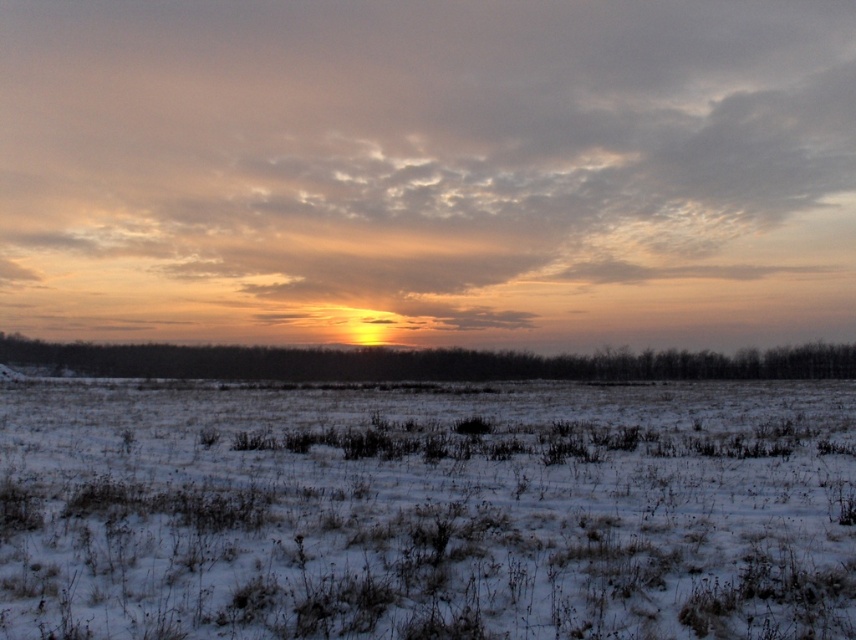
Question: Can you confirm if cloudy sky at center is smaller than white snow-covered grassland at center?

Choices:
 (A) yes
 (B) no

Answer: (B)

Question: Which point is farther from the camera taking this photo?

Choices:
 (A) (432, 120)
 (B) (605, 500)

Answer: (A)

Question: Is cloudy sky at center above white snow-covered grassland at center?

Choices:
 (A) yes
 (B) no

Answer: (A)

Question: Among these objects, which one is farthest from the camera?

Choices:
 (A) cloudy sky at center
 (B) white snow-covered grassland at center

Answer: (A)

Question: Is cloudy sky at center wider than white snow-covered grassland at center?

Choices:
 (A) no
 (B) yes

Answer: (B)